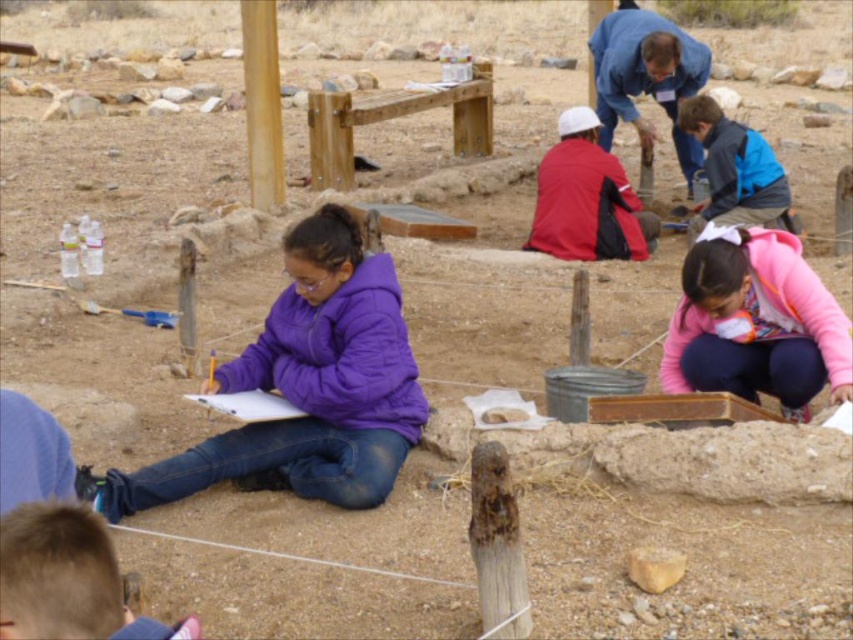
What can be found at the coordinates point (67,579) in the archaeological dig site?

At point (67,579) in the archaeological dig site, you can find blonde hair at lower left.